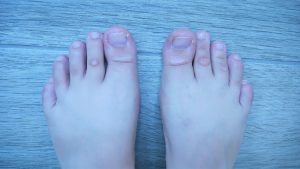
You are a GUI agent. You are given a task and a screenshot of the screen. Output one action in this format:
    pyautogui.click(x=<x>, y=<y>)
    Task: Click on the floor
    This screenshot has width=300, height=169.
    Given the screenshot: What is the action you would take?
    pyautogui.click(x=248, y=36)